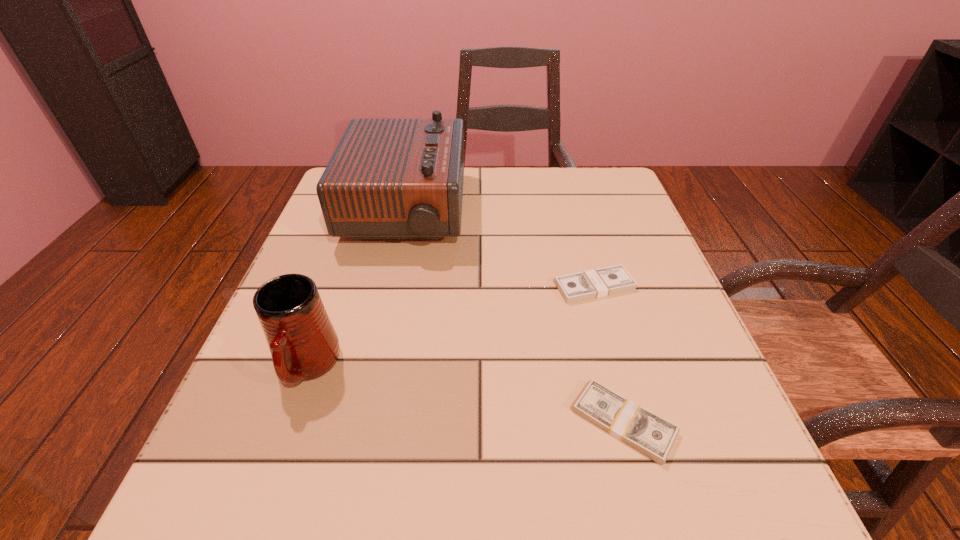
Locate an element on the screen. The image size is (960, 540). object at the near edge is located at coordinates (651, 435).

Find the location of a particular element. radio receiver that is at the left edge is located at coordinates (388, 178).

I want to click on mug located at the left edge, so click(303, 343).

Locate an element on the screen. The width and height of the screenshot is (960, 540). object located in the far left corner section of the desktop is located at coordinates (388, 178).

Identify the location of object located at the near right corner. This screenshot has height=540, width=960. (651, 435).

I want to click on free space at the far edge of the desktop, so click(x=503, y=197).

What are the coordinates of `vacant region at the near edge of the desktop` in the screenshot? It's located at (410, 532).

Find the location of a particular element. vacant space at the left edge of the desktop is located at coordinates (356, 314).

The height and width of the screenshot is (540, 960). In the image, there is a desktop. What are the coordinates of `vacant area at the right edge` in the screenshot? It's located at (655, 360).

In the image, there is a desktop. Find the location of `vacant space at the near left corner`. vacant space at the near left corner is located at coordinates (262, 508).